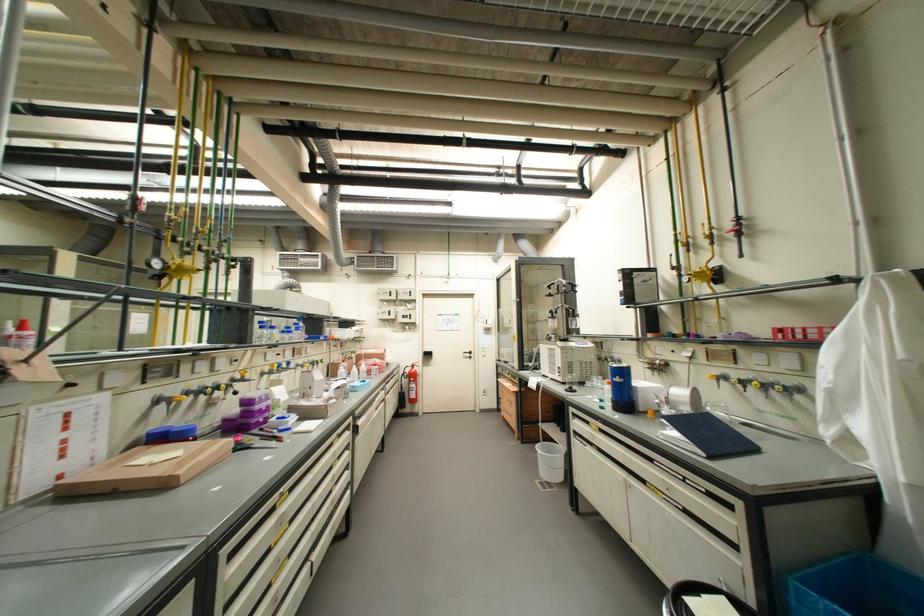
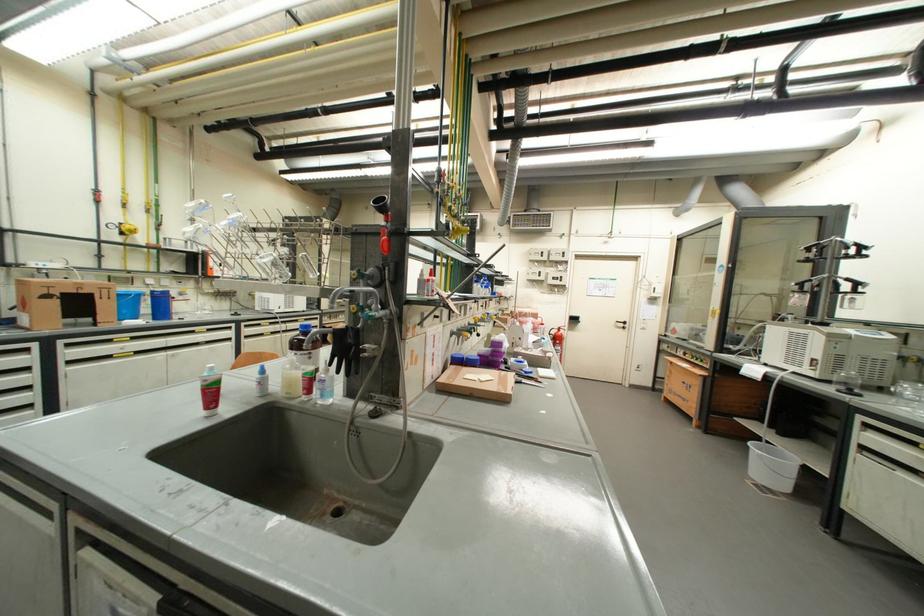
Question: Based on the continuous images, in which direction is the camera rotating? Reply with the corresponding letter.

Choices:
 (A) Left
 (B) Right
 (C) Up
 (D) Down

Answer: (A)